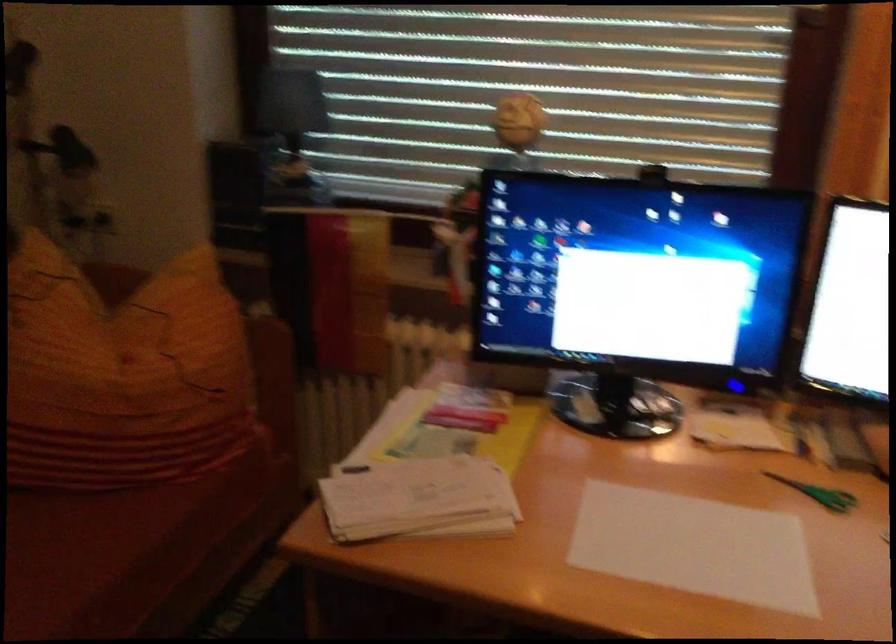
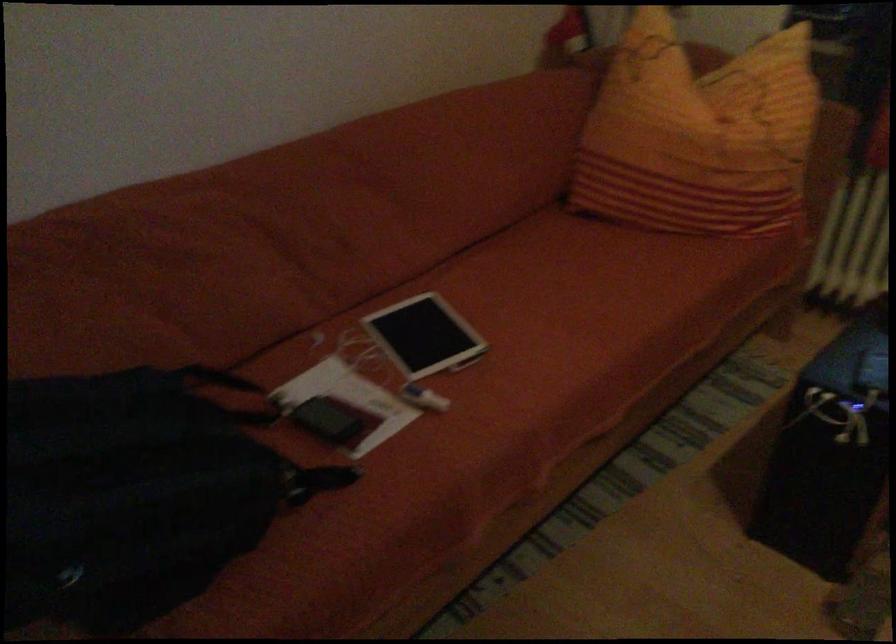
The point at (x=97, y=383) is marked in the first image. Where is the corresponding point in the second image?

(698, 135)